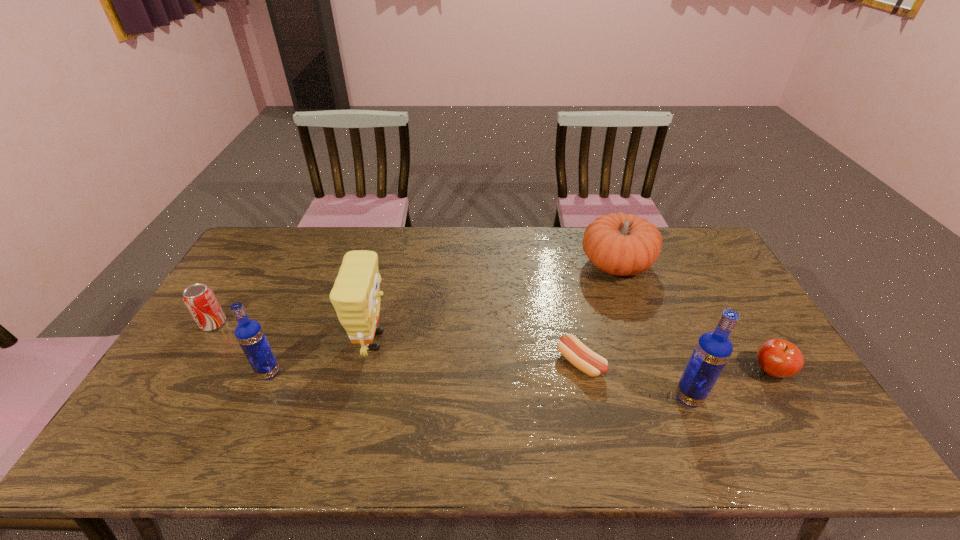
The image size is (960, 540). I want to click on object that is the second closest one to the fifth object from right to left, so click(200, 300).

Identify the location of object that is the fifth closest to the nearer vodka. This screenshot has width=960, height=540. (249, 333).

This screenshot has width=960, height=540. In order to click on vacant area in the image that satisfies the following two spatial constraints: 1. on the face of the sponge; 2. on the back side of the sixth tallest object in this screenshot , I will do `click(367, 371)`.

I want to click on vacant space that satisfies the following two spatial constraints: 1. on the face of the fifth object from right to left; 2. on the left side of the sixth tallest object, so click(367, 371).

I want to click on vacant position in the image that satisfies the following two spatial constraints: 1. on the face of the rightmost object; 2. on the left side of the third object from left to right, so click(x=367, y=371).

Locate an element on the screen. blank area in the image that satisfies the following two spatial constraints: 1. on the face of the sixth tallest object; 2. on the right side of the third object from left to right is located at coordinates (367, 371).

The image size is (960, 540). I want to click on vacant space that satisfies the following two spatial constraints: 1. on the front side of the taller vodka; 2. on the left side of the fourth tallest object, so click(x=665, y=397).